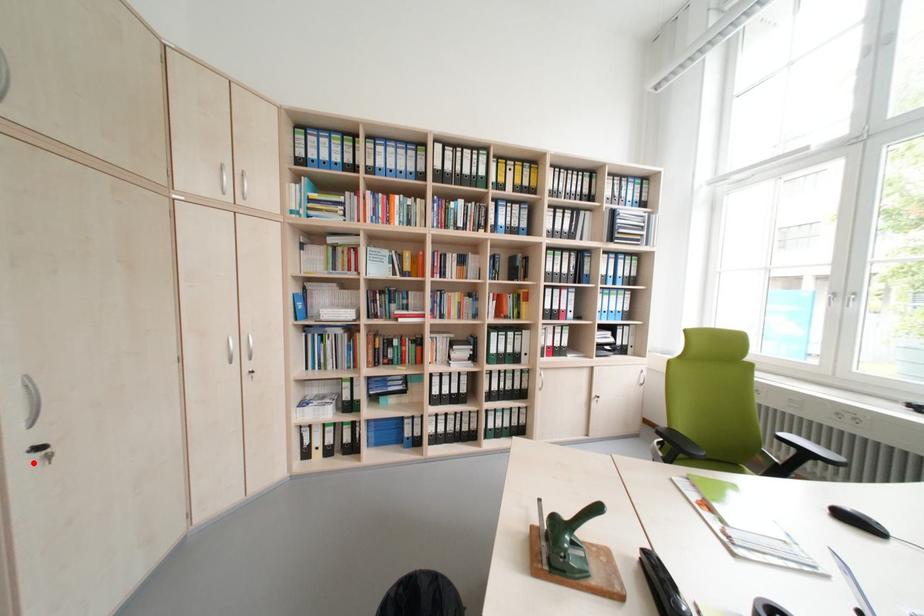
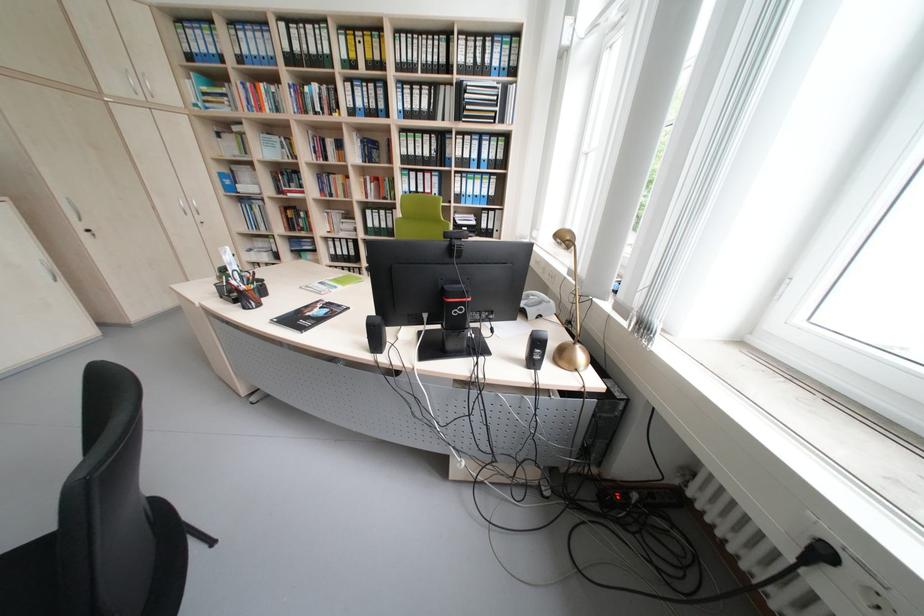
In the second image, find the point that corresponds to the highlighted location in the first image.

(93, 236)